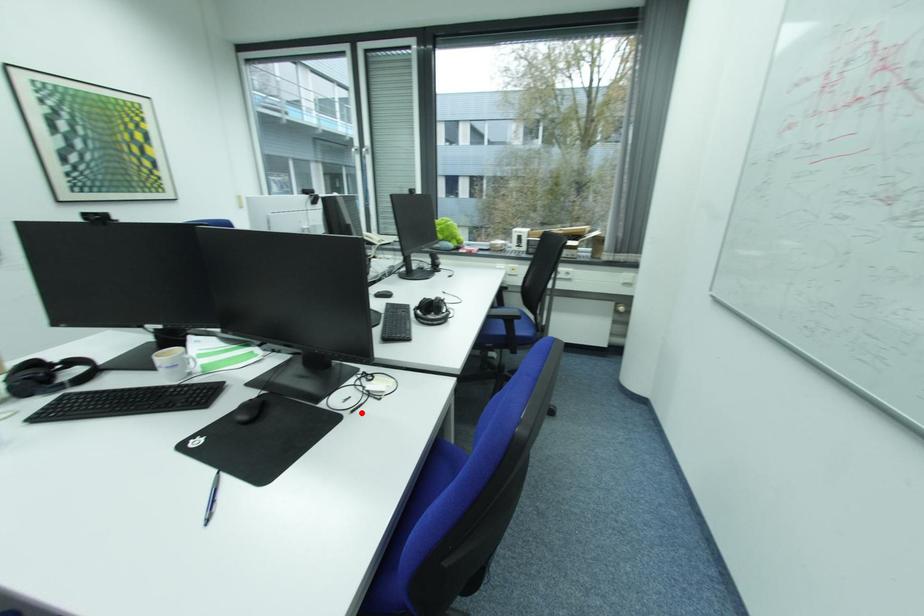
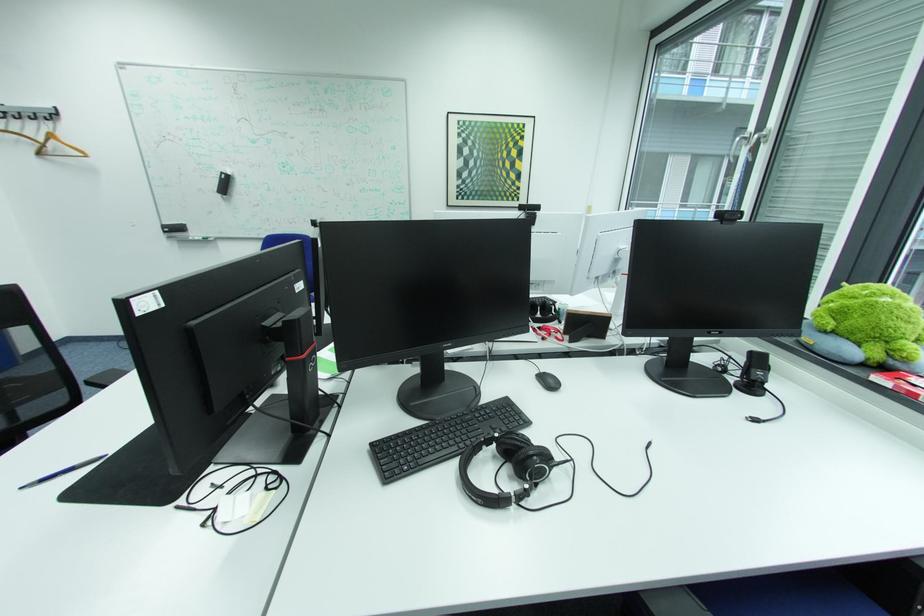
Find the pixel in the second image that matches the highlighted location in the first image.

(187, 508)